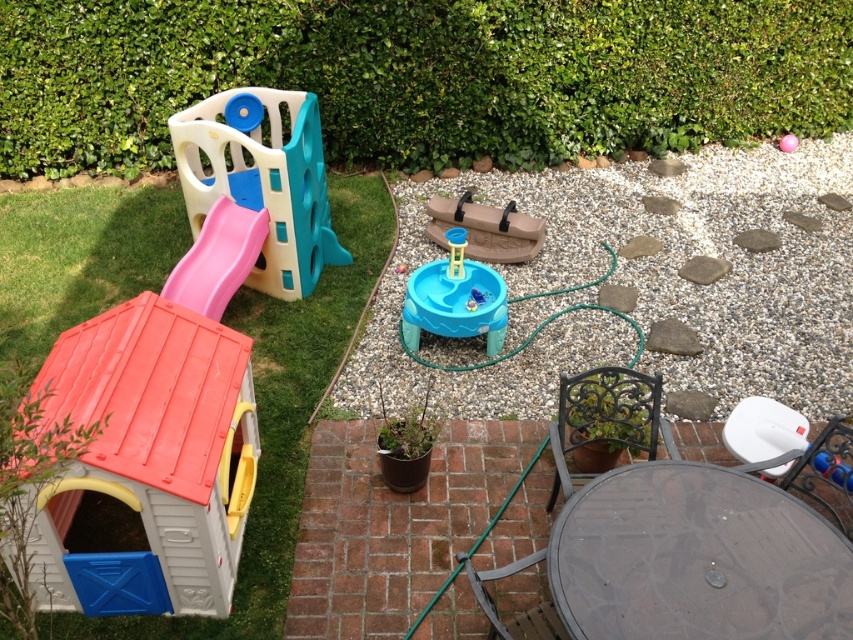
Question: Which of the following is the closest to the observer?

Choices:
 (A) white gravel at center
 (B) white plastic chair at lower right
 (C) plastic playhouse at left
 (D) blue plastic water table at center

Answer: (C)

Question: Is plastic playhouse at left to the left of white plastic chair at lower right from the viewer's perspective?

Choices:
 (A) yes
 (B) no

Answer: (A)

Question: Can you confirm if white plastic chair at lower right is positioned to the right of pink plastic slide at upper left?

Choices:
 (A) no
 (B) yes

Answer: (B)

Question: Considering the real-world distances, which object is farthest from the white gravel at center?

Choices:
 (A) green leafy hedge at upper left
 (B) matte plastic playhouse at upper left
 (C) pink rubber ball at center

Answer: (C)

Question: Which object appears closest to the camera in this image?

Choices:
 (A) white plastic chair at lower right
 (B) pink plastic slide at upper left

Answer: (A)

Question: Observing the image, what is the correct spatial positioning of white gravel at center in reference to matte plastic playhouse at upper left?

Choices:
 (A) above
 (B) below

Answer: (B)